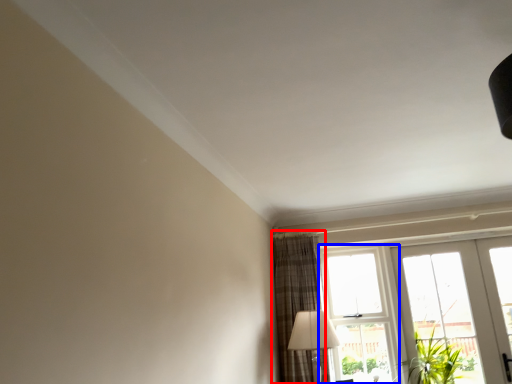
Question: Which object is closer to the camera taking this photo, curtain (highlighted by a red box) or window (highlighted by a blue box)?

Choices:
 (A) curtain
 (B) window

Answer: (A)